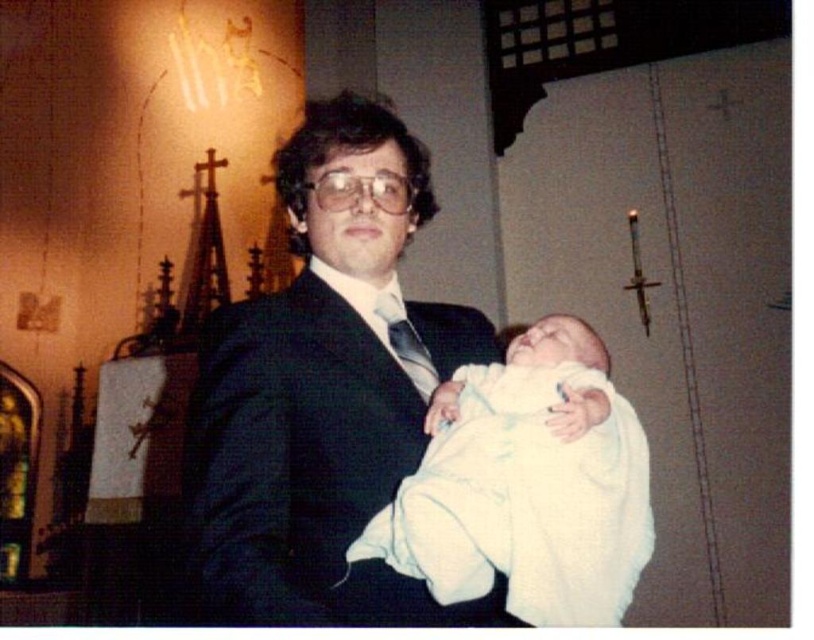
Question: Can you confirm if black satin suit at center is wider than white soft cloth at center?

Choices:
 (A) yes
 (B) no

Answer: (A)

Question: Where is black satin suit at center located in relation to white soft cloth at center in the image?

Choices:
 (A) right
 (B) left

Answer: (B)

Question: Which point is farther from the camera taking this photo?

Choices:
 (A) (410, 556)
 (B) (357, 189)

Answer: (B)

Question: Is black satin suit at center closer to camera compared to white soft cloth at center?

Choices:
 (A) no
 (B) yes

Answer: (B)